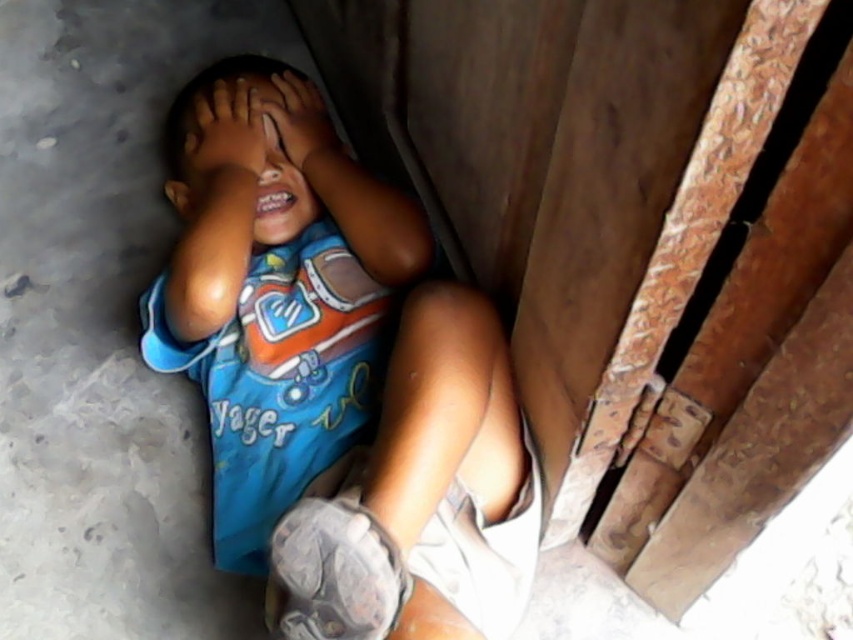
Which is in front, point (431, 333) or point (223, 160)?

Point (431, 333)

Is blue cotton shirt at center wider than blue fabric head at center?

Indeed, blue cotton shirt at center has a greater width compared to blue fabric head at center.

Who is more distant from viewer, (187, 193) or (178, 205)?

The point (178, 205) is behind.

Where is `blue cotton shirt at center`? The image size is (853, 640). blue cotton shirt at center is located at coordinates (344, 401).

Which of these two, blue cotton shirt at center or smooth skin hand at center, stands shorter?

Standing shorter between the two is smooth skin hand at center.

Does point (173, 282) come farther from viewer compared to point (241, 163)?

No, it is not.

Locate an element on the screen. blue cotton shirt at center is located at coordinates (344, 401).

Who is lower down, matte skin hand at center or brown matte eye at center?

Positioned lower is brown matte eye at center.

Who is positioned more to the left, matte skin hand at center or brown matte eye at center?

brown matte eye at center is more to the left.

I want to click on matte skin hand at center, so (300, 122).